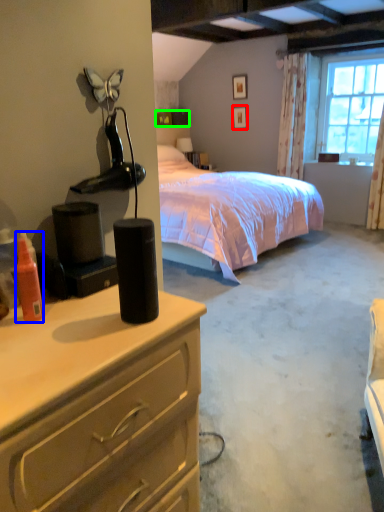
Question: Which is nearer to the picture frame (highlighted by a red box)? bottle (highlighted by a blue box) or box (highlighted by a green box).

Choices:
 (A) bottle
 (B) box

Answer: (B)